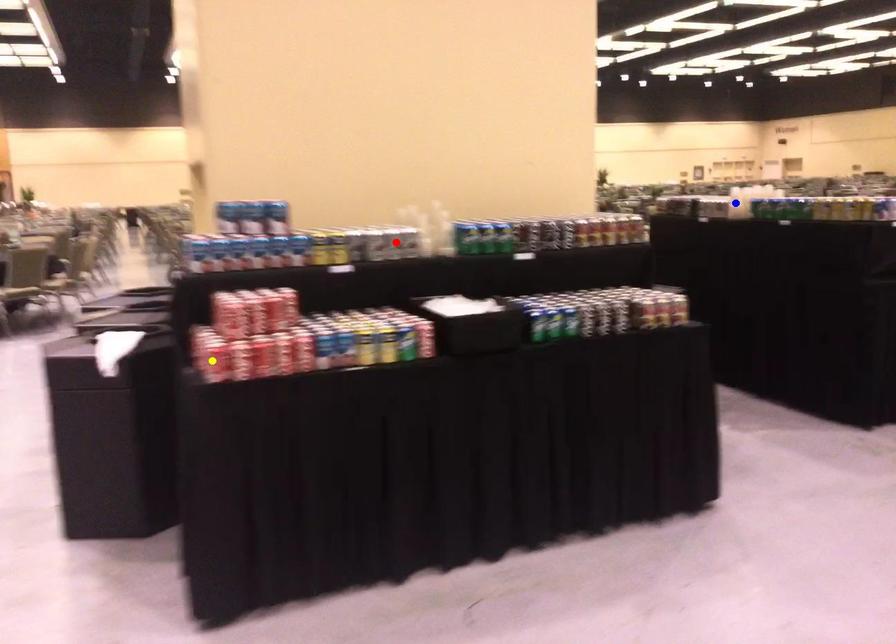
Order these from nearest to farthest:
- blue point
- red point
- yellow point

yellow point, red point, blue point